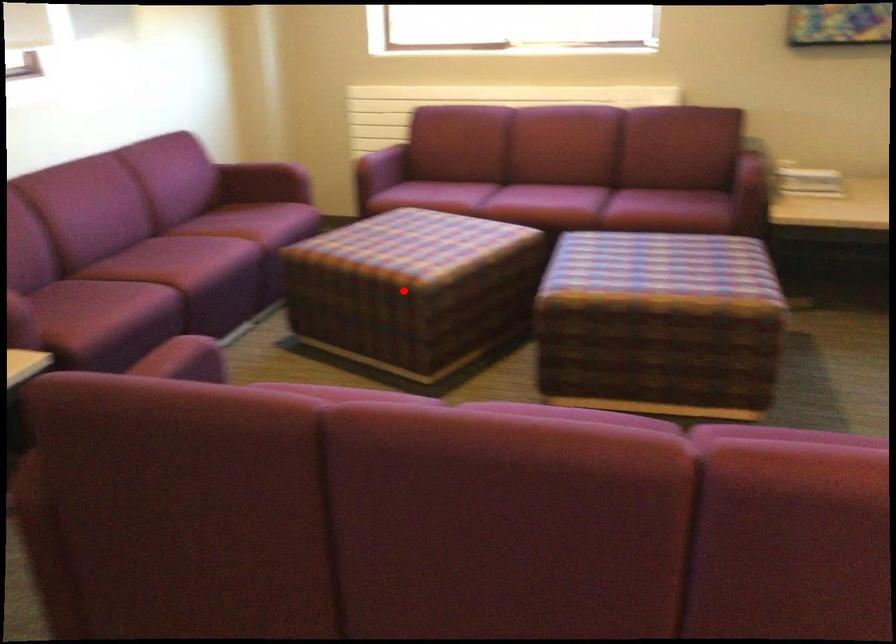
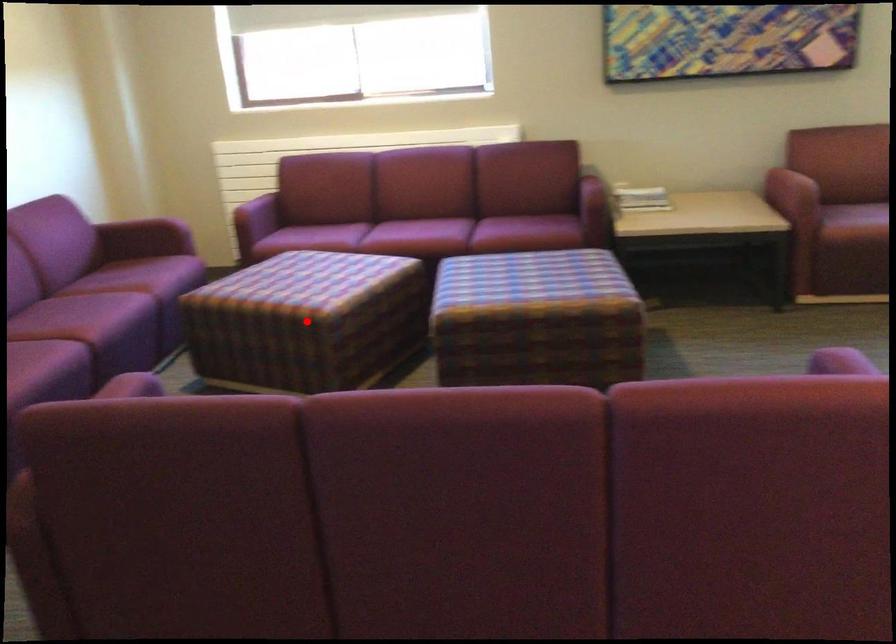
I am providing you with two images of the same scene from different viewpoints. A red point is marked on the first image and another point is marked on the second image. Is the red point in image1 aligned with the point shown in image2?

Yes